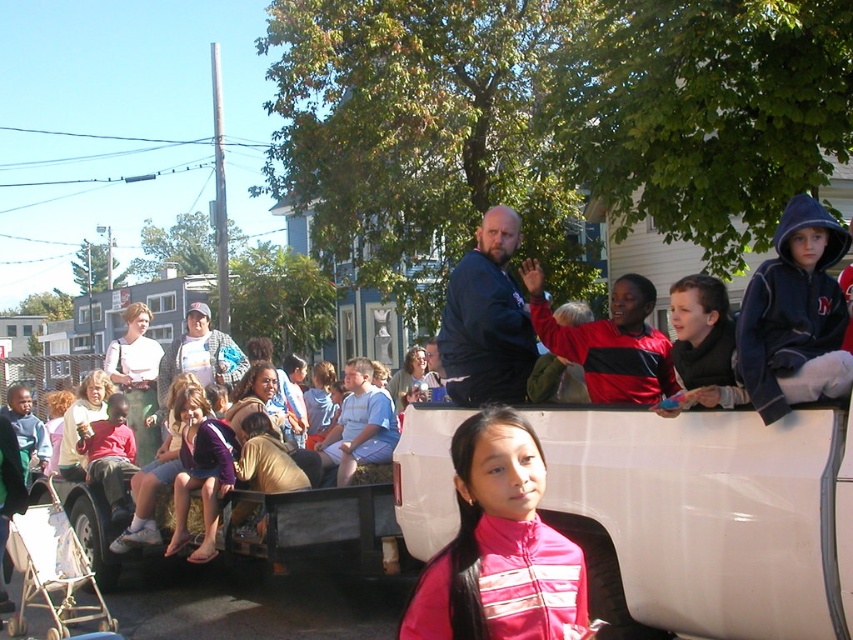
Is matte blue shirt at center closer to the viewer compared to dark blue jacket at center?

No.

Looking at this image, does matte blue shirt at center have a greater width compared to dark blue jacket at center?

Indeed, matte blue shirt at center has a greater width compared to dark blue jacket at center.

Which is behind, point (236, 500) or point (482, 285)?

Positioned behind is point (236, 500).

Find the location of a particular element. matte blue shirt at center is located at coordinates (318, 525).

Is dark blue hoodie at right smaller than red and black jacket at upper right?

Yes, dark blue hoodie at right is smaller than red and black jacket at upper right.

Identify the location of dark blue hoodie at right. (793, 316).

The image size is (853, 640). Identify the location of dark blue hoodie at right. (793, 316).

Is point (538, 497) positioned after point (834, 252)?

No, (538, 497) is closer to viewer.

Is point (503, 540) positioned behind point (757, 369)?

That is False.

I want to click on pink fabric jacket at center, so click(x=498, y=547).